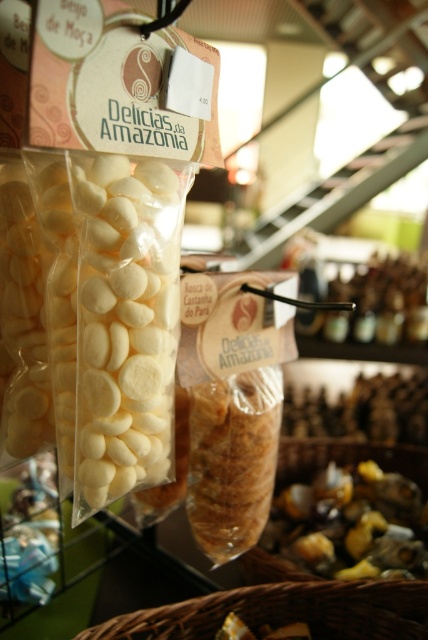
Question: Considering the relative positions of white matte candy at center and woven brown basket at lower center in the image provided, where is white matte candy at center located with respect to woven brown basket at lower center?

Choices:
 (A) below
 (B) above

Answer: (B)

Question: Where is shiny metallic nuts at lower right located in relation to woven brown basket at lower center in the image?

Choices:
 (A) below
 (B) above

Answer: (B)

Question: Among these points, which one is nearest to the camera?

Choices:
 (A) (261, 538)
 (B) (104, 445)
 (C) (91, 634)

Answer: (B)

Question: Which point is farther to the camera?

Choices:
 (A) (160, 618)
 (B) (124, 321)

Answer: (A)

Question: Which point appears farthest from the camera in this image?

Choices:
 (A) (386, 600)
 (B) (160, 227)

Answer: (A)

Question: Can you confirm if white matte candy at center is positioned to the left of woven brown basket at lower center?

Choices:
 (A) no
 (B) yes

Answer: (B)